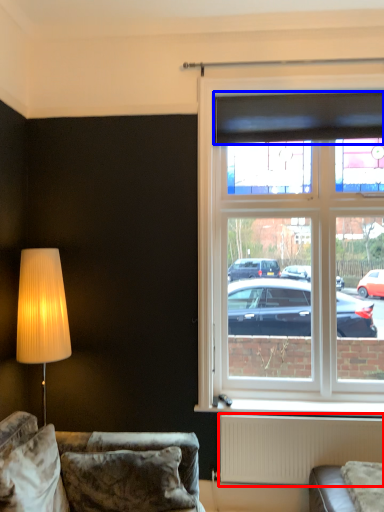
Question: Which of the following is the closest to the observer, radiator (highlighted by a red box) or curtain (highlighted by a blue box)?

Choices:
 (A) radiator
 (B) curtain

Answer: (A)